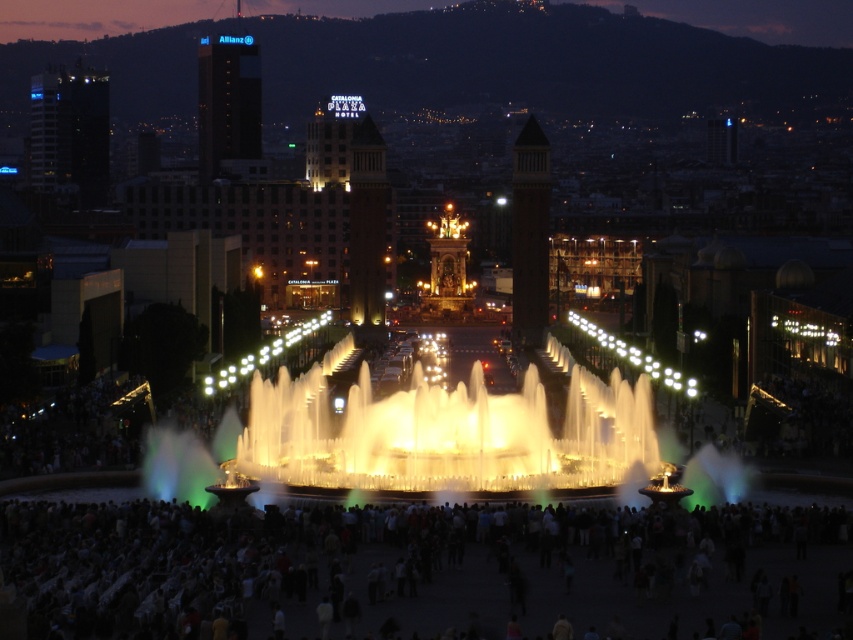
Question: Which of the following is the closest to the observer?

Choices:
 (A) (842, 589)
 (B) (274, 429)

Answer: (A)

Question: Observing the image, what is the correct spatial positioning of dark gray crowd at center in reference to illuminated water at center?

Choices:
 (A) left
 (B) right

Answer: (A)

Question: Does dark gray crowd at center have a greater width compared to illuminated water at center?

Choices:
 (A) yes
 (B) no

Answer: (A)

Question: Which point appears farthest from the camera in this image?

Choices:
 (A) (316, 392)
 (B) (25, 586)

Answer: (A)

Question: Can you confirm if dark gray crowd at center is bigger than illuminated water at center?

Choices:
 (A) yes
 (B) no

Answer: (B)